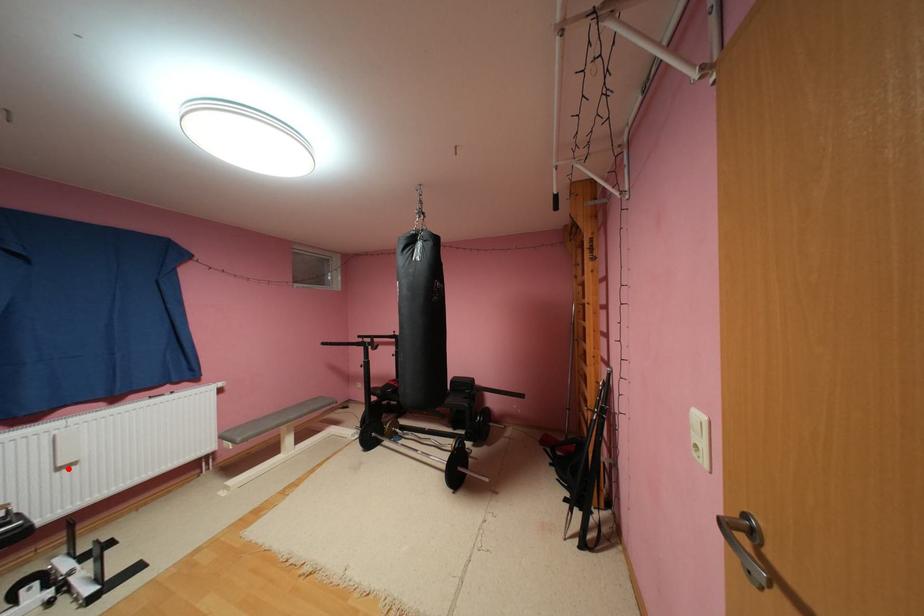
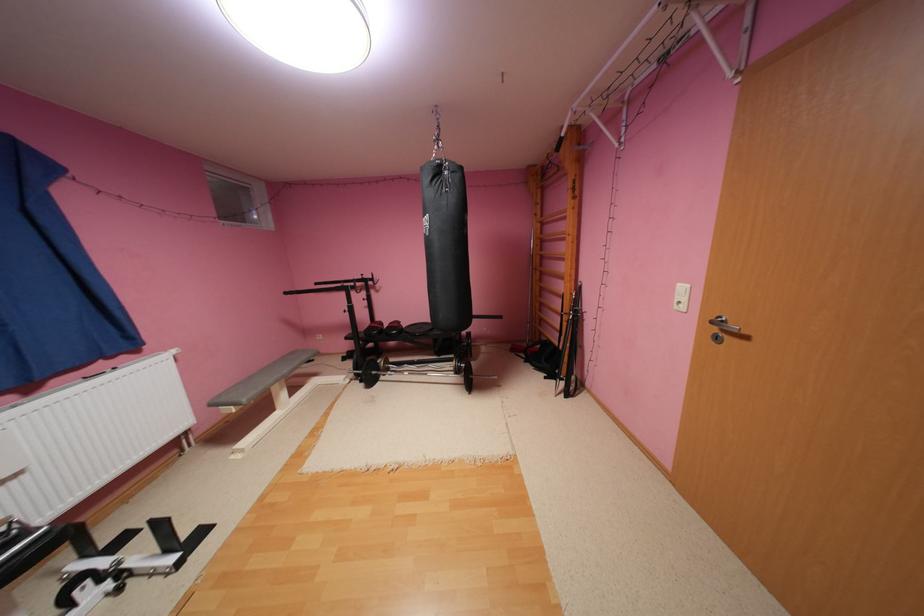
The point at the highlighted location is marked in the first image. Where is the corresponding point in the second image?

(11, 483)